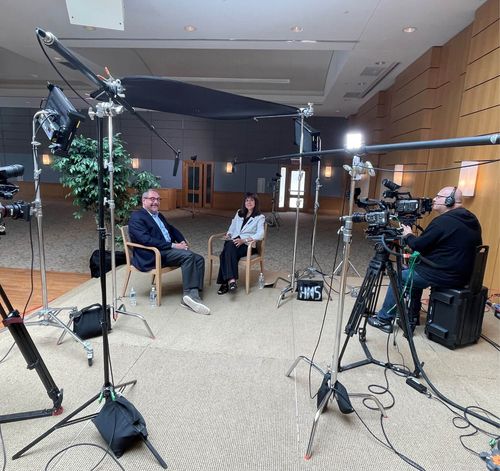
At what (x,y) coordinates should I click in order to perform the action: click on cylinder light sconce. Please return your answer as a coordinate pair (x, y). Looking at the image, I should click on point(469,172), point(397,176), point(327,170), point(229,169), point(136,164), point(46,159).